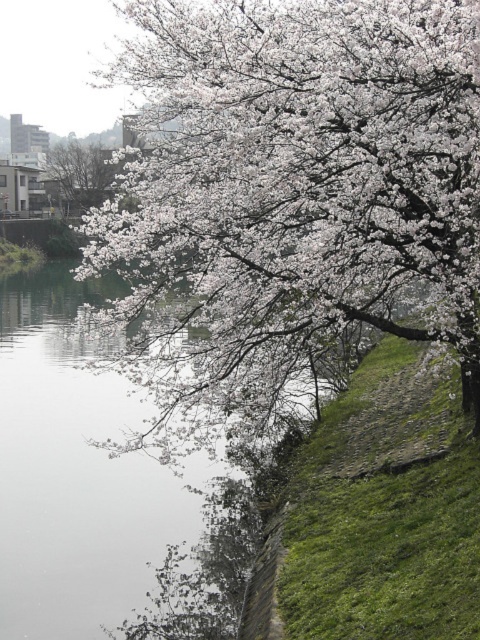
Question: Which object appears farthest from the camera in this image?

Choices:
 (A) white matte blossoms at upper center
 (B) white matte tree at upper center

Answer: (B)

Question: Is white matte blossoms at upper center wider than white matte tree at upper center?

Choices:
 (A) no
 (B) yes

Answer: (B)

Question: Which of the following is the closest to the observer?

Choices:
 (A) (80, 164)
 (B) (302, 294)

Answer: (B)

Question: Does white matte blossoms at upper center appear under white matte tree at upper center?

Choices:
 (A) yes
 (B) no

Answer: (A)

Question: Does white matte blossoms at upper center appear on the left side of white matte tree at upper center?

Choices:
 (A) no
 (B) yes

Answer: (A)